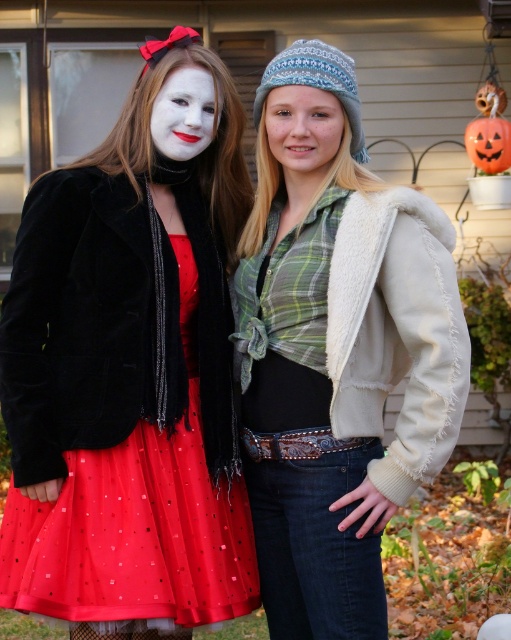
Is white knit hat at upper center to the right of smooth knit hat at center from the viewer's perspective?

Correct, you'll find white knit hat at upper center to the right of smooth knit hat at center.

Measure the distance between point (x=397, y=371) and camera.

3.72 meters

In order to click on white knit hat at upper center in this screenshot , I will do `click(338, 365)`.

Which is in front, point (25, 412) or point (385, 497)?

Point (385, 497) is more forward.

This screenshot has height=640, width=511. What do you see at coordinates (128, 380) in the screenshot?
I see `velvet black jacket at left` at bounding box center [128, 380].

Who is more forward, (175, 198) or (349, 164)?

Point (349, 164)

Identify the location of velvet black jacket at left. This screenshot has width=511, height=640. (128, 380).

Consider the image. Which is more to the right, smooth knit hat at center or matte white face at center?

Positioned to the right is smooth knit hat at center.

Is smooth knit hat at center thinner than matte white face at center?

Incorrect, smooth knit hat at center's width is not less than matte white face at center's.

The width and height of the screenshot is (511, 640). What do you see at coordinates (303, 129) in the screenshot?
I see `smooth knit hat at center` at bounding box center [303, 129].

The width and height of the screenshot is (511, 640). What are the coordinates of `smooth knit hat at center` in the screenshot? It's located at (303, 129).